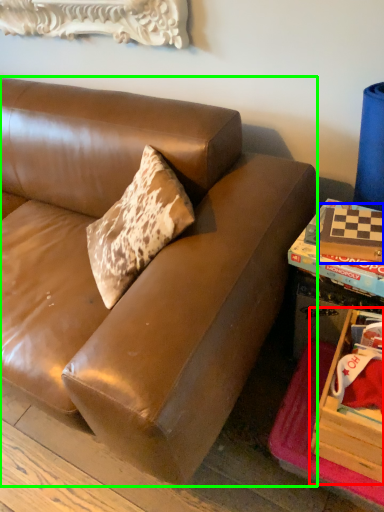
Question: Based on their relative distances, which object is nearer to storage box (highlighted by a red box)? Choose from book (highlighted by a blue box) and studio couch (highlighted by a green box).

Choices:
 (A) book
 (B) studio couch

Answer: (A)